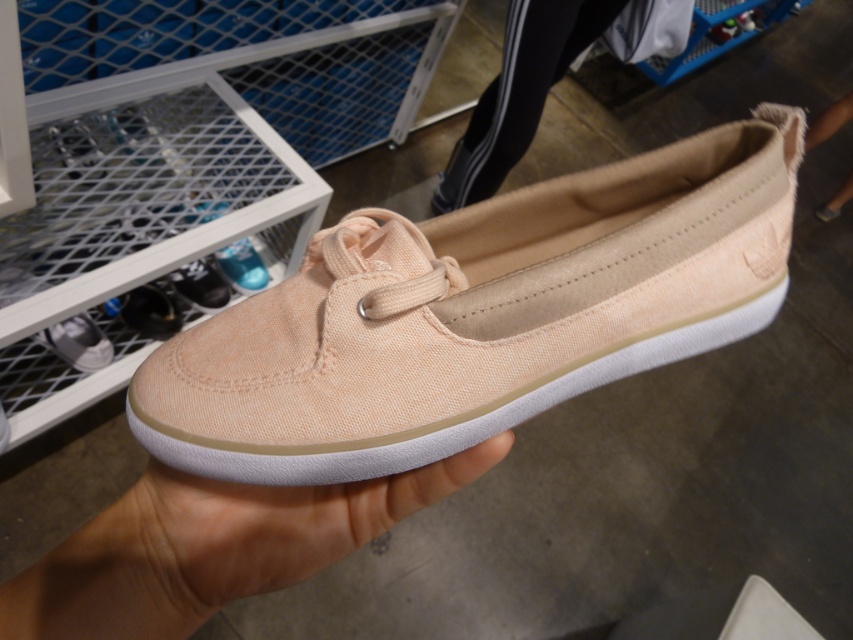
Question: From the image, what is the correct spatial relationship of light pink canvas shoe at center in relation to matte pink canvas shoe at lower center?

Choices:
 (A) above
 (B) below

Answer: (B)

Question: Among these points, which one is nearest to the camera?

Choices:
 (A) (173, 417)
 (B) (241, 557)
 (C) (96, 324)

Answer: (A)

Question: Is peach canvas slip-on at center positioned before matte pink canvas shoe at lower center?

Choices:
 (A) no
 (B) yes

Answer: (B)

Question: Which of these objects is positioned farthest from the peach canvas slip-on at center?

Choices:
 (A) light pink canvas shoe at center
 (B) matte pink canvas shoe at lower center

Answer: (B)

Question: Is peach canvas slip-on at center further to camera compared to light pink canvas shoe at center?

Choices:
 (A) yes
 (B) no

Answer: (B)

Question: Which is nearer to the light pink canvas shoe at center?

Choices:
 (A) matte pink canvas shoe at lower center
 (B) peach canvas slip-on at center

Answer: (B)